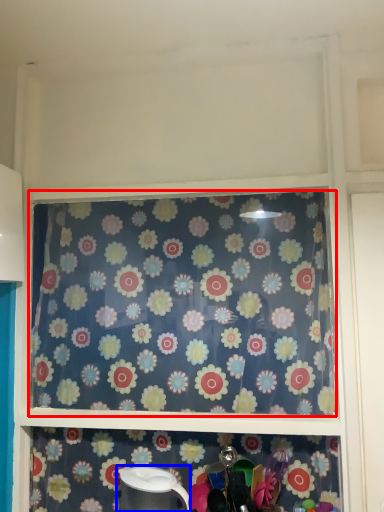
Question: Which of the following is the closest to the observer, curtain (highlighted by a red box) or appliance (highlighted by a blue box)?

Choices:
 (A) curtain
 (B) appliance

Answer: (B)